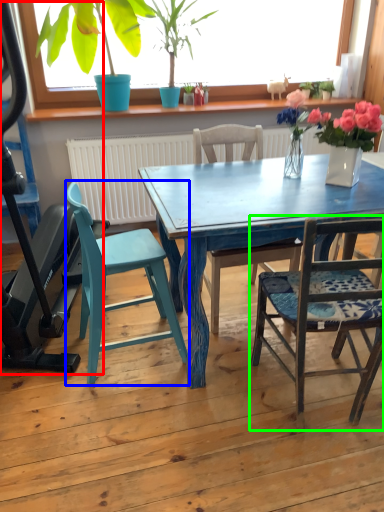
Question: Considering the real-world distances, which object is closest to baby carriage (highlighted by a red box)? chair (highlighted by a blue box) or chair (highlighted by a green box).

Choices:
 (A) chair
 (B) chair

Answer: (A)